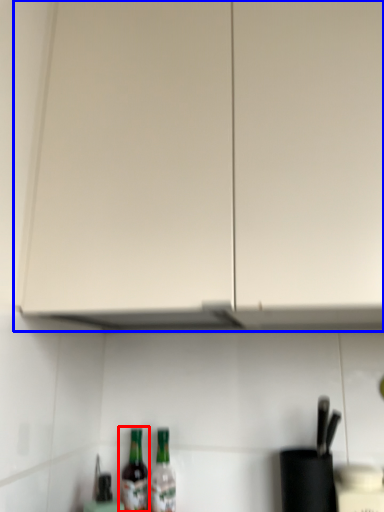
Question: Which object is closer to the camera taking this photo, bottle (highlighted by a red box) or cabinetry (highlighted by a blue box)?

Choices:
 (A) bottle
 (B) cabinetry

Answer: (B)